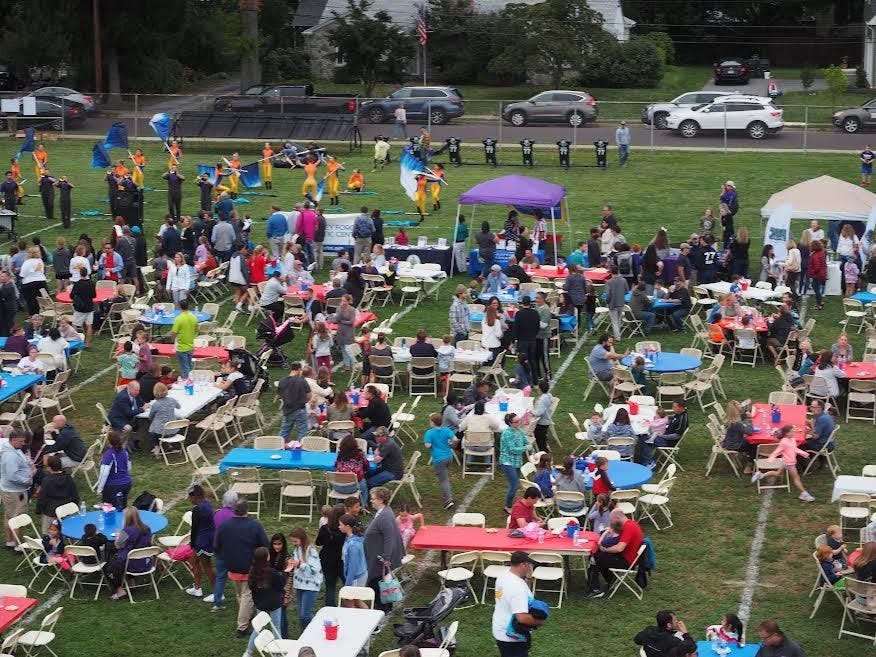
Locate an element on the screen. Image resolution: width=876 pixels, height=657 pixels. 8 visible center table pieces is located at coordinates (295, 453), (325, 633), (569, 528), (774, 414), (745, 284), (511, 309), (187, 386), (107, 514).